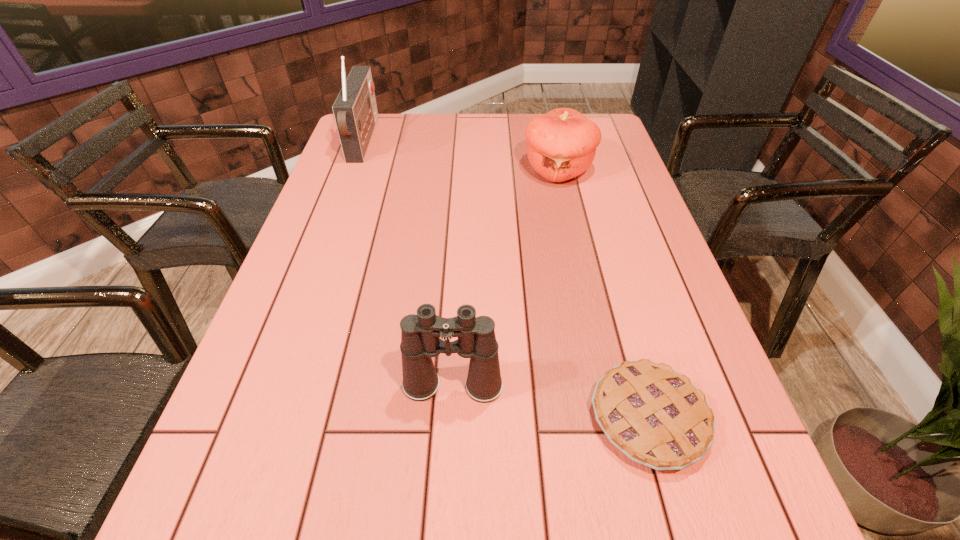
Locate an element on the screen. The height and width of the screenshot is (540, 960). the tallest object is located at coordinates (355, 111).

Find the location of a particular element. radio receiver is located at coordinates (355, 111).

Identify the location of the second tallest object. Image resolution: width=960 pixels, height=540 pixels. (420, 333).

Locate an element on the screen. the second object from left to right is located at coordinates (420, 333).

Locate an element on the screen. pumpkin is located at coordinates (561, 144).

Find the location of `pie`. pie is located at coordinates (657, 417).

Identify the location of blank space located on the front panel of the radio receiver. (489, 141).

What are the coordinates of `vacant space located on the left of the third object from right to left` in the screenshot? It's located at (x=299, y=386).

Locate an element on the screen. The height and width of the screenshot is (540, 960). vacant region located on the right of the third tallest object is located at coordinates (609, 171).

You are a GUI agent. You are given a task and a screenshot of the screen. Output one action in this format:
    pyautogui.click(x=<x>, y=<y>)
    Task: Click on the free space located 0.180m on the left of the shortest object
    The image size is (960, 540).
    Given the screenshot: What is the action you would take?
    pyautogui.click(x=492, y=418)